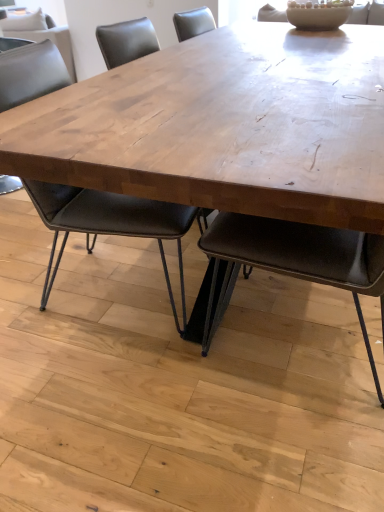
Identify the location of brown leather chair at center. Image resolution: width=384 pixels, height=512 pixels. 110,223.

What do you see at coordinates (110, 223) in the screenshot?
I see `brown leather chair at center` at bounding box center [110, 223].

The width and height of the screenshot is (384, 512). Find the location of `brown leather chair at center`. brown leather chair at center is located at coordinates (110, 223).